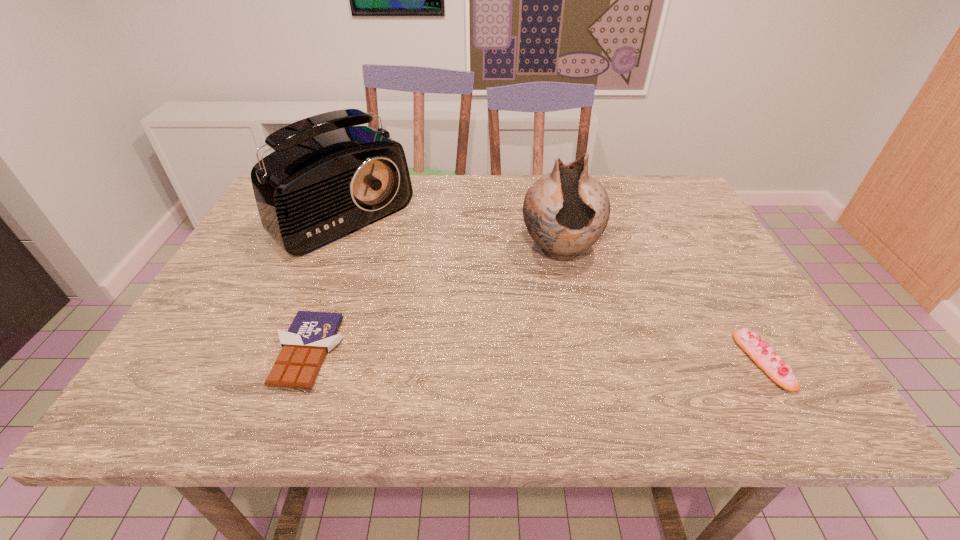
The width and height of the screenshot is (960, 540). Find the location of `vacant point located between the shortest object and the radio receiver`. vacant point located between the shortest object and the radio receiver is located at coordinates (323, 282).

You are a GUI agent. You are given a task and a screenshot of the screen. Output one action in this format:
    pyautogui.click(x=<x>, y=<y>)
    Task: Click on the vacant area between the radio receiver and the eclair
    Image resolution: width=960 pixels, height=540 pixels.
    Given the screenshot: What is the action you would take?
    pyautogui.click(x=550, y=287)

Where is `vacant space that is in between the third object from left to right and the eclair`? vacant space that is in between the third object from left to right and the eclair is located at coordinates (661, 306).

Identify the location of vacant space that is in between the radio receiver and the rightmost object. (550, 287).

The image size is (960, 540). I want to click on object identified as the third closest to the rightmost object, so click(x=311, y=335).

Point out which object is positioned as the nearest to the pottery. Please provide its 2D coordinates. Your answer should be formatted as a tuple, i.e. [(x, y)], where the tuple contains the x and y coordinates of a point satisfying the conditions above.

[(759, 351)]

I want to click on free spot that satisfies the following two spatial constraints: 1. on the front side of the chocolate bar; 2. on the right side of the eclair, so click(x=304, y=361).